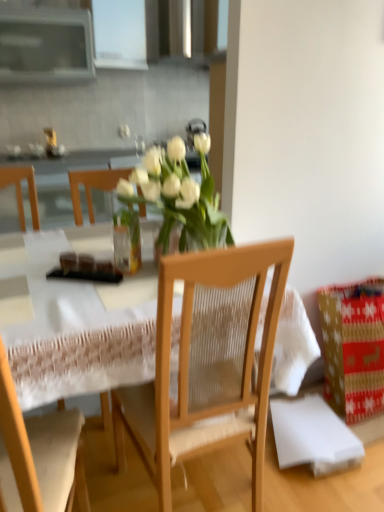
Question: In terms of height, does matte brown bread at table look taller or shorter compared to wooden table at center?

Choices:
 (A) tall
 (B) short

Answer: (B)

Question: Looking at their shapes, would you say matte brown bread at table is wider or thinner than wooden table at center?

Choices:
 (A) wide
 (B) thin

Answer: (B)

Question: Estimate the real-world distances between objects in this image. Which object is closer to the red paper gift at lower right?

Choices:
 (A) matte brown bread at table
 (B) wooden chair at center, which appears as the 1th chair when viewed from the left
 (C) wooden table at center
 (D) wooden chair at center, placed as the first chair when sorted from right to left
 (E) transparent glass vase at center

Answer: (D)

Question: Estimate the real-world distances between objects in this image. Which object is closer to the wooden chair at center, which is the 2th chair in left-to-right order?

Choices:
 (A) transparent glass vase at center
 (B) red paper gift at lower right
 (C) wooden table at center
 (D) matte brown bread at table
 (E) wooden chair at center, which appears as the 1th chair when viewed from the left

Answer: (C)